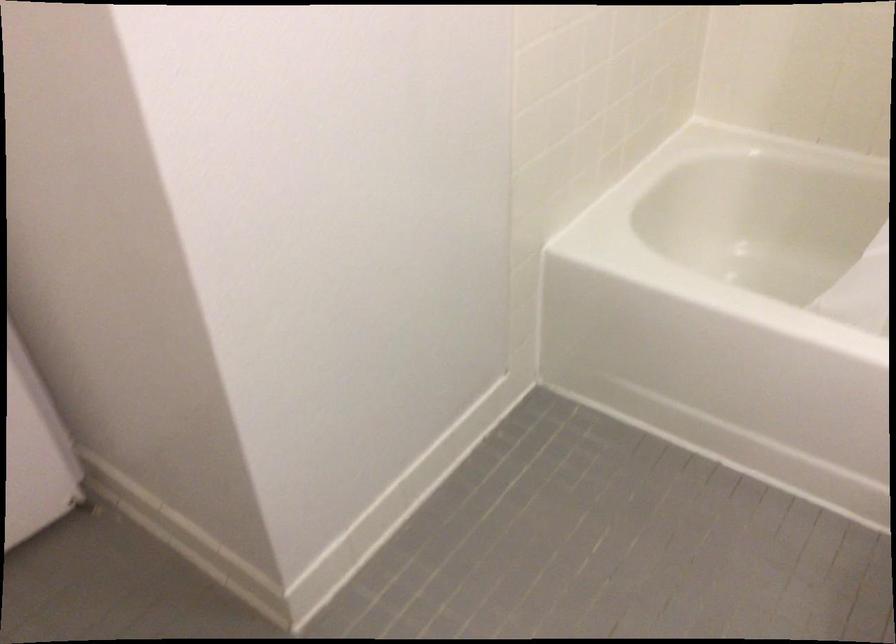
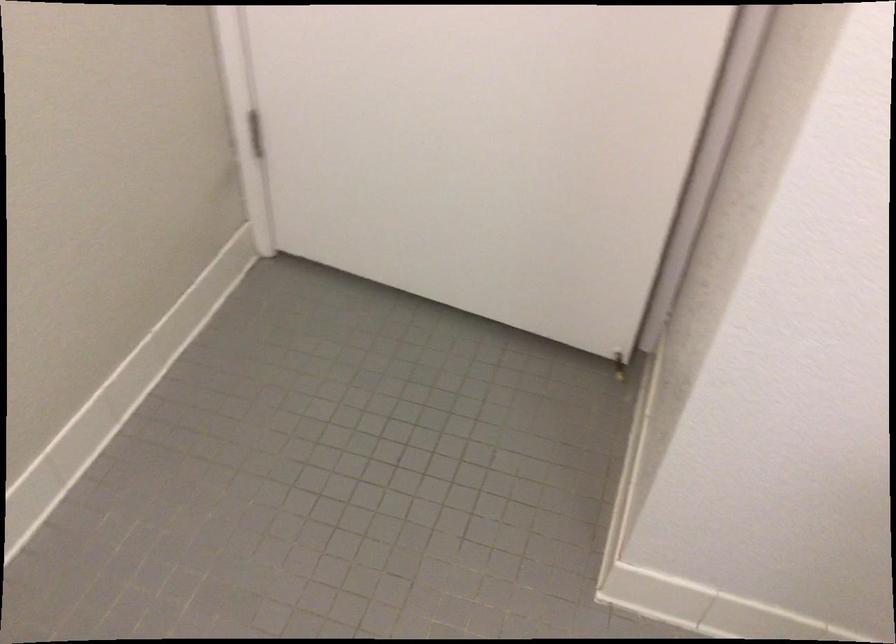
Where in the second image is the point corresponding to the point at 72,505 from the first image?

(618, 366)